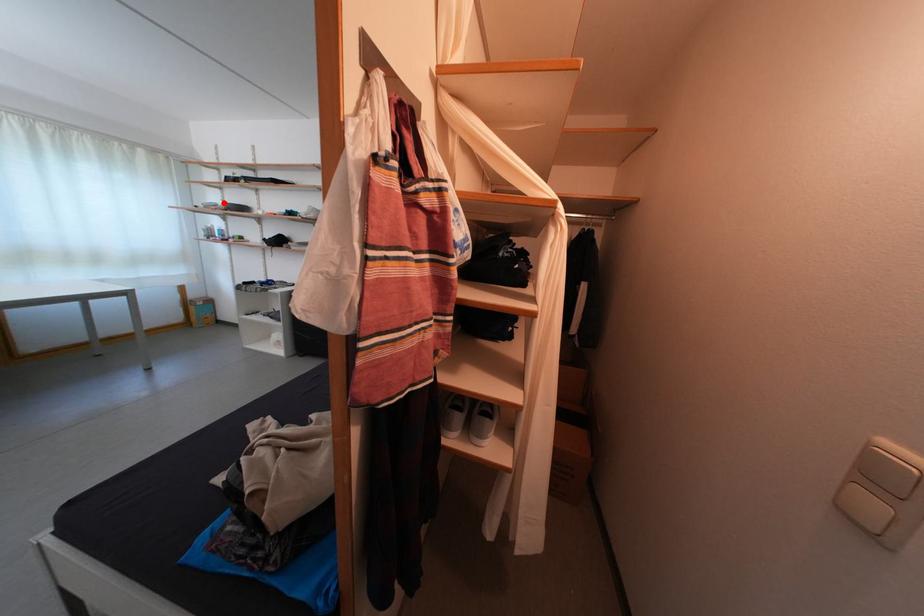
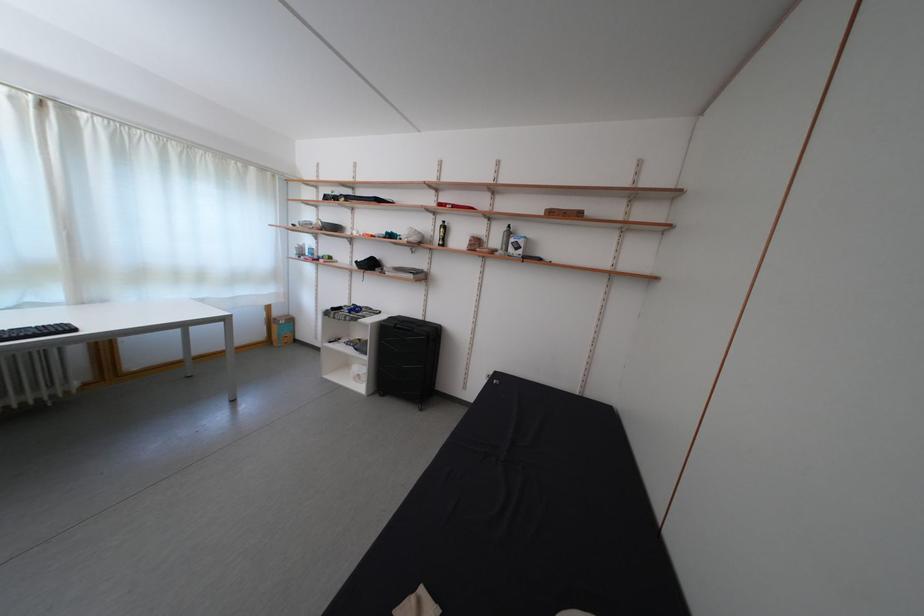
In the second image, find the point that corresponds to the highlighted location in the first image.

(319, 221)